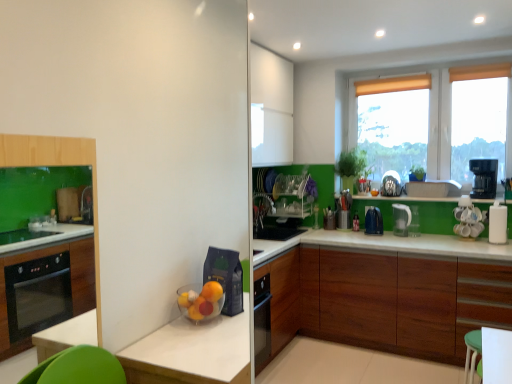
Question: Is the position of translucent plastic window at upper right more distant than that of satin silver kettle at upper right, positioned as the 2th appliance in left-to-right order?

Choices:
 (A) yes
 (B) no

Answer: (B)

Question: From a real-world perspective, is translucent plastic window at upper right located higher than satin silver kettle at upper right, the third appliance from the right?

Choices:
 (A) no
 (B) yes

Answer: (B)

Question: Is translucent plastic window at upper right far away from satin silver kettle at upper right, the third appliance from the right?

Choices:
 (A) yes
 (B) no

Answer: (B)

Question: Is translucent plastic window at upper right not inside satin silver kettle at upper right, the third appliance from the right?

Choices:
 (A) no
 (B) yes

Answer: (B)

Question: Is translucent plastic window at upper right facing towards satin silver kettle at upper right, the third appliance from the right?

Choices:
 (A) no
 (B) yes

Answer: (B)

Question: Is wooden cabinet at lower right wider or thinner than black plastic coffee maker at upper right, the third kitchen appliance from the left?

Choices:
 (A) wide
 (B) thin

Answer: (A)

Question: In terms of height, does wooden cabinet at lower right look taller or shorter compared to black plastic coffee maker at upper right, arranged as the first kitchen appliance when viewed from the right?

Choices:
 (A) tall
 (B) short

Answer: (A)

Question: Which is correct: wooden cabinet at lower right is inside black plastic coffee maker at upper right, the third kitchen appliance from the left, or outside of it?

Choices:
 (A) inside
 (B) outside

Answer: (B)

Question: Considering the positions of point [x=312, y=254] and point [x=492, y=182], is point [x=312, y=254] closer or farther from the camera than point [x=492, y=182]?

Choices:
 (A) farther
 (B) closer

Answer: (A)

Question: Considering the positions of white glossy coffee maker at right, arranged as the second appliance when viewed from the front, and white glossy paper towel dispenser at right, the 4th appliance in the left-to-right sequence, in the image, is white glossy coffee maker at right, arranged as the second appliance when viewed from the front, bigger or smaller than white glossy paper towel dispenser at right, the 4th appliance in the left-to-right sequence,?

Choices:
 (A) small
 (B) big

Answer: (B)

Question: Is white glossy coffee maker at right, the 3th appliance positioned from the left, taller or shorter than white glossy paper towel dispenser at right, the 4th appliance in the left-to-right sequence?

Choices:
 (A) tall
 (B) short

Answer: (A)

Question: Relative to white glossy paper towel dispenser at right, the 1th appliance viewed from the front, is white glossy coffee maker at right, the 3th appliance positioned from the left, in front or behind?

Choices:
 (A) front
 (B) behind

Answer: (B)

Question: Is point (462, 215) closer or farther from the camera than point (490, 206)?

Choices:
 (A) closer
 (B) farther

Answer: (B)

Question: Relative to metallic silver utensil holder at center-right, marked as the 4th appliance in a front-to-back arrangement, is clear plastic pitcher at upper right, the second kitchen appliance when ordered from right to left, in front or behind?

Choices:
 (A) front
 (B) behind

Answer: (A)

Question: From a real-world perspective, is clear plastic pitcher at upper right, which is the 2th kitchen appliance from left to right, positioned above or below metallic silver utensil holder at center-right, marked as the 4th appliance in a front-to-back arrangement?

Choices:
 (A) above
 (B) below

Answer: (B)